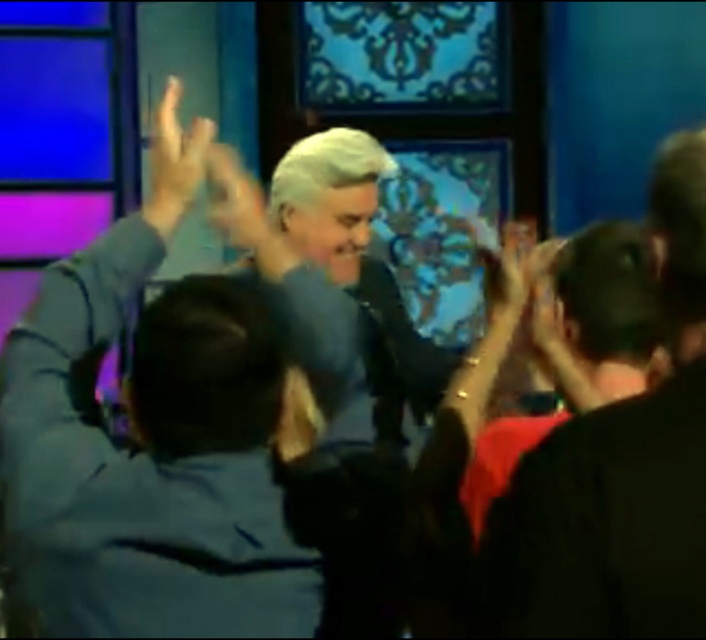
Question: Among these objects, which one is farthest from the camera?

Choices:
 (A) dark brown hair at upper right
 (B) light blue shirt at center
 (C) matte black hand at upper left
 (D) white matte wig at center

Answer: (D)

Question: Based on their relative distances, which object is nearer to the matte yellow hand at center?

Choices:
 (A) matte black hand at upper center
 (B) white matte wig at center

Answer: (A)

Question: Can you confirm if dark suit at center is bigger than matte black hand at upper center?

Choices:
 (A) no
 (B) yes

Answer: (B)

Question: From the image, what is the correct spatial relationship of smooth black shirt at right in relation to dark suit at center?

Choices:
 (A) below
 (B) above

Answer: (B)

Question: Is dark brown hair at upper right to the left of matte black hand at upper left from the viewer's perspective?

Choices:
 (A) yes
 (B) no

Answer: (B)

Question: Among these objects, which one is nearest to the camera?

Choices:
 (A) dark suit at center
 (B) matte black hand at upper left

Answer: (B)